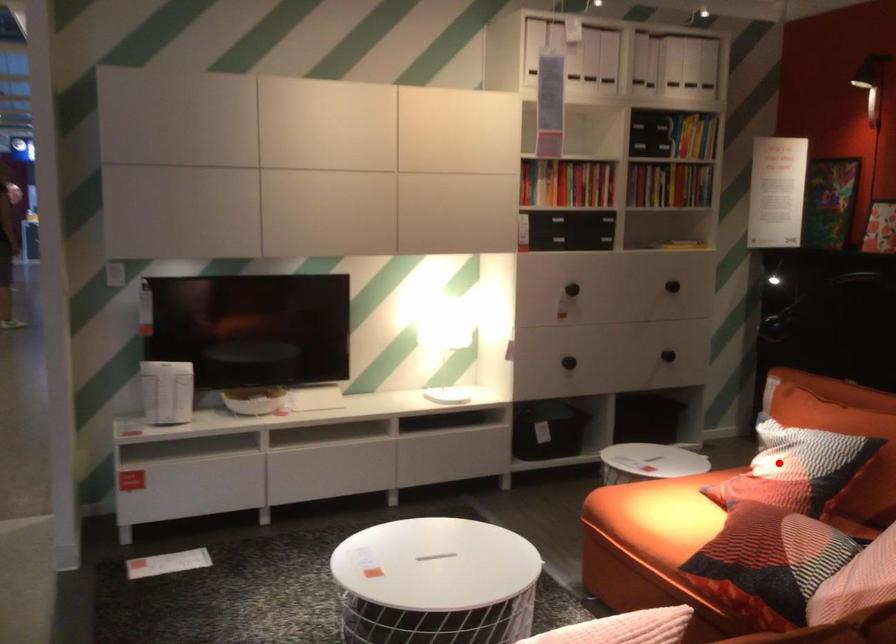
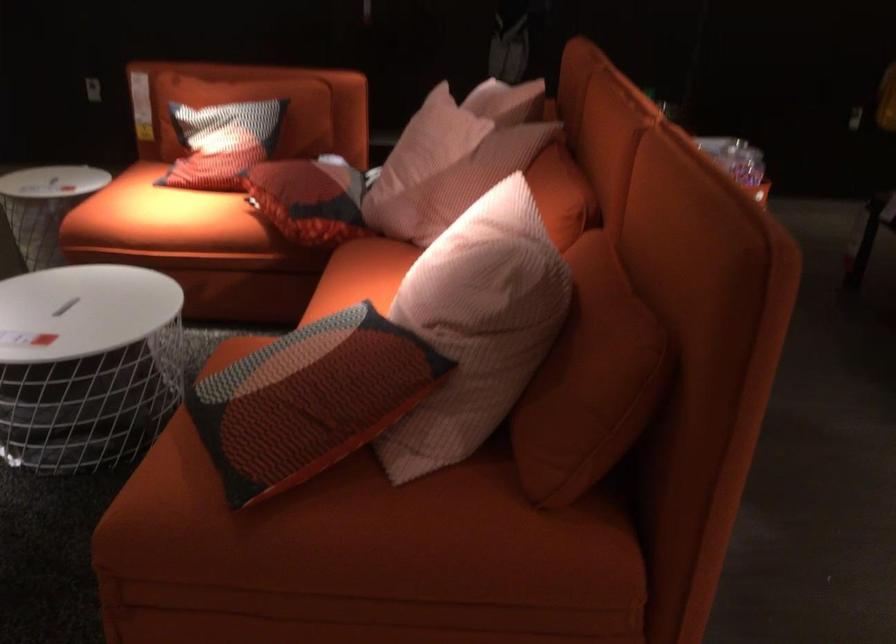
Locate, in the second image, the point that corresponds to the highlighted location in the first image.

(222, 142)